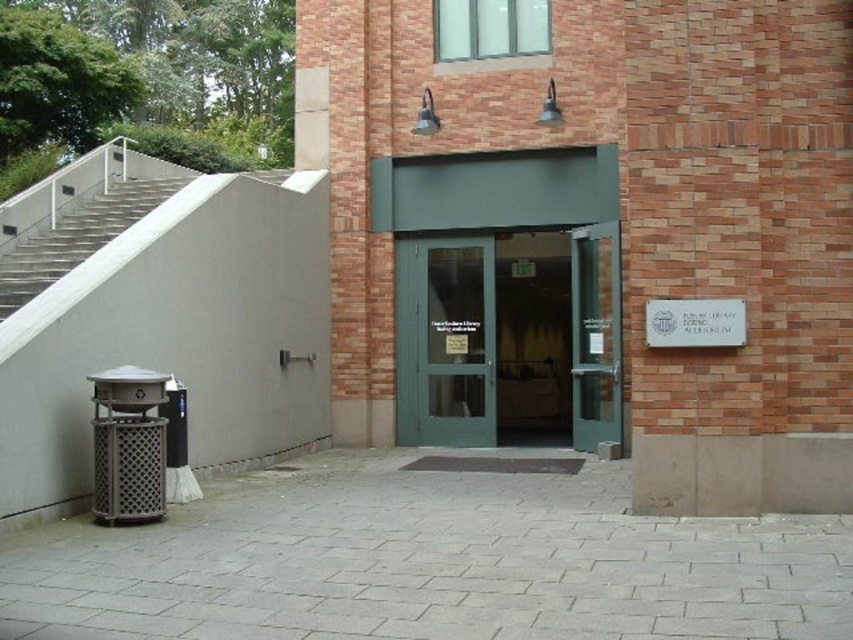
Question: Can you confirm if green glass door at center is thinner than green matte door at center?

Choices:
 (A) no
 (B) yes

Answer: (B)

Question: Which is farther from the green matte door at center?

Choices:
 (A) gray concrete stairs at left
 (B) green glass door at center

Answer: (A)

Question: Does green matte door at center have a lesser width compared to gray concrete stairs at left?

Choices:
 (A) no
 (B) yes

Answer: (B)

Question: Estimate the real-world distances between objects in this image. Which object is farther from the gray concrete stairs at left?

Choices:
 (A) green glass door at center
 (B) green matte door at center

Answer: (A)

Question: Which point is farther to the camera?

Choices:
 (A) gray concrete stairs at left
 (B) green glass door at center
 (C) green matte door at center

Answer: (B)

Question: Can you confirm if green glass door at center is smaller than green matte door at center?

Choices:
 (A) yes
 (B) no

Answer: (A)